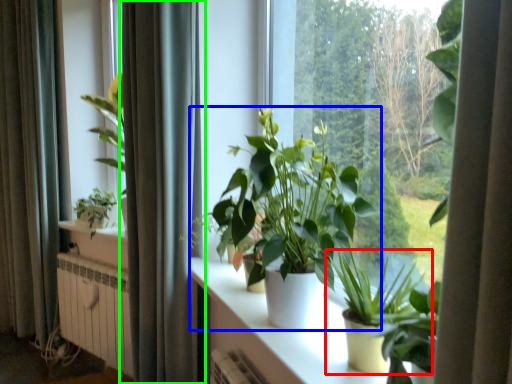
Question: Based on their relative distances, which object is nearer to houseplant (highlighted by a red box)? Choose from houseplant (highlighted by a blue box) and curtain (highlighted by a green box).

Choices:
 (A) houseplant
 (B) curtain

Answer: (A)